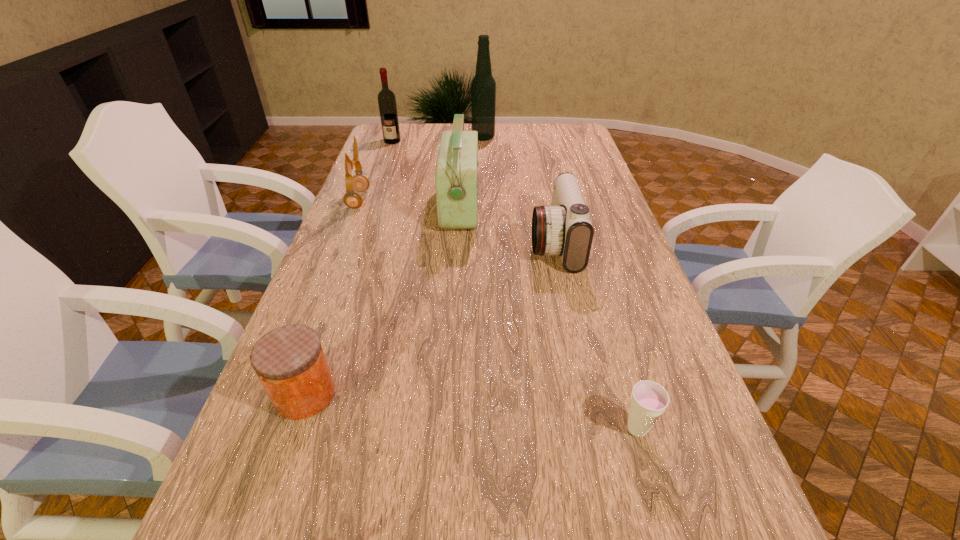
Image resolution: width=960 pixels, height=540 pixels. What are the coordinates of `vacant space located on the front panel of the radio receiver` in the screenshot? It's located at (497, 207).

What are the coordinates of `vacant space located on the front-facing side of the earphone` in the screenshot? It's located at (442, 200).

This screenshot has width=960, height=540. Identify the location of vacant space situated on the surface of the camcorder. (465, 244).

The height and width of the screenshot is (540, 960). Find the location of `vacant region located 0.060m on the surface of the camcorder`. vacant region located 0.060m on the surface of the camcorder is located at coordinates (511, 244).

Locate an element on the screen. The width and height of the screenshot is (960, 540). vacant space located 0.130m on the surface of the camcorder is located at coordinates (488, 244).

The image size is (960, 540). What are the coordinates of `free space located on the back of the second shortest object` in the screenshot? It's located at (337, 302).

The width and height of the screenshot is (960, 540). I want to click on vacant space situated 0.350m on the left of the cup, so click(x=445, y=429).

What are the coordinates of `alcohol present at the left edge` in the screenshot? It's located at (386, 98).

Where is `earphone that is at the left edge`? earphone that is at the left edge is located at coordinates (352, 199).

Locate an element on the screen. jar located at the left edge is located at coordinates (289, 361).